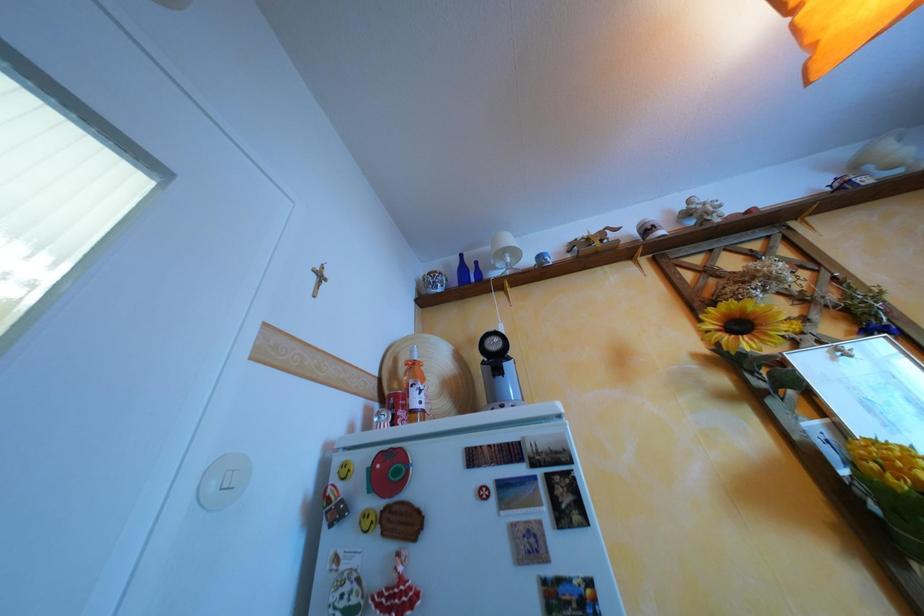
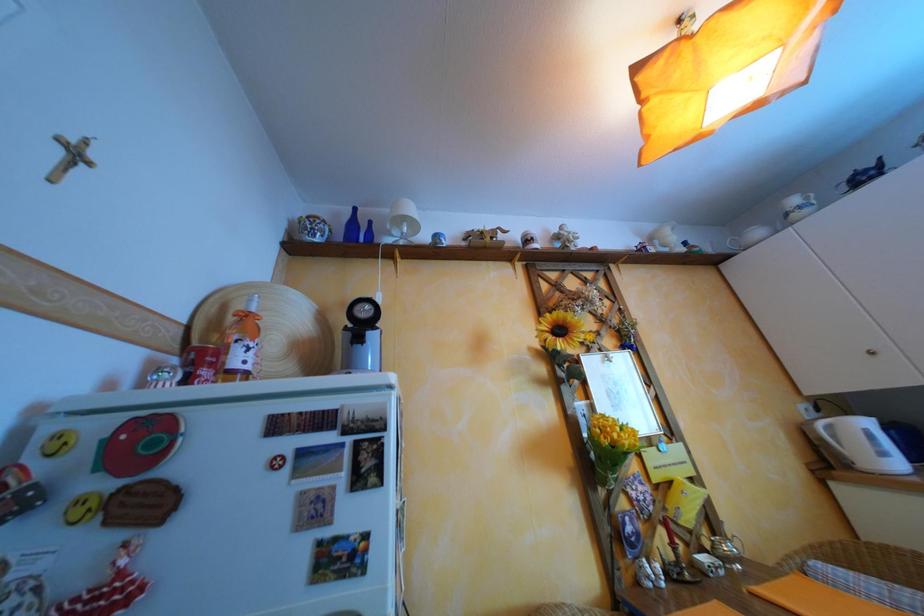
Question: In a continuous first-person perspective shot, in which direction is the camera moving?

Choices:
 (A) Left
 (B) Right
 (C) Forward
 (D) Backward

Answer: (B)